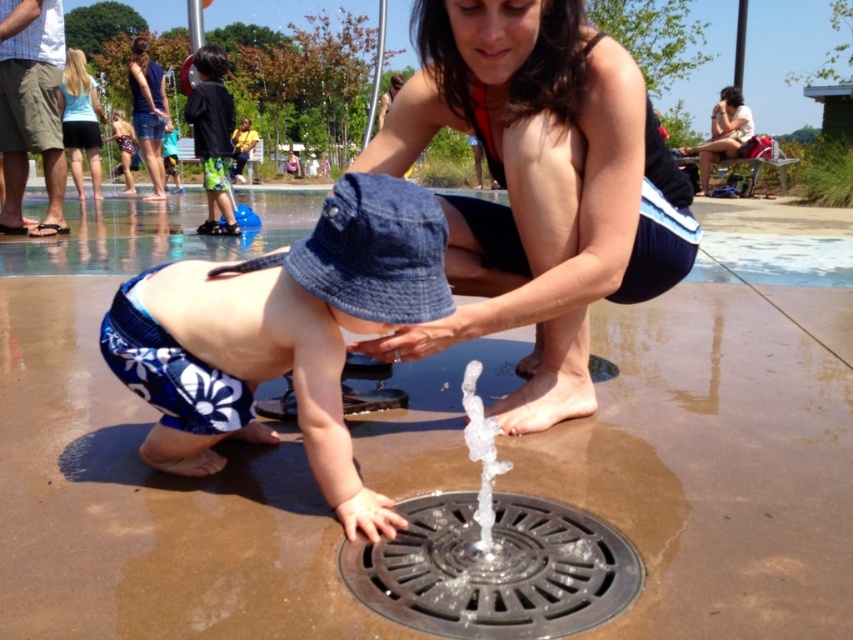
From the picture: Between black metal drain at center and green shorts at center, which one has more height?

green shorts at center is taller.

Who is higher up, black metal drain at center or green shorts at center?

green shorts at center is above.

This screenshot has width=853, height=640. What do you see at coordinates (494, 568) in the screenshot?
I see `black metal drain at center` at bounding box center [494, 568].

In order to click on black metal drain at center in this screenshot , I will do `click(494, 568)`.

Who is positioned more to the left, matte black swimsuit at center or green shorts at center?

green shorts at center

The height and width of the screenshot is (640, 853). What are the coordinates of `matte black swimsuit at center` in the screenshot? It's located at (538, 188).

Does point (579, 145) come farther from viewer compared to point (200, 140)?

No, (579, 145) is closer to viewer.

Locate an element on the screen. matte black swimsuit at center is located at coordinates (538, 188).

What are the coordinates of `blue floral swim trunks at lower left` in the screenshot? It's located at (280, 333).

Who is more distant from viewer, (172, 426) or (520, 557)?

The point (172, 426) is behind.

This screenshot has height=640, width=853. What do you see at coordinates (280, 333) in the screenshot?
I see `blue floral swim trunks at lower left` at bounding box center [280, 333].

Where is `blue floral swim trunks at lower left`? This screenshot has height=640, width=853. blue floral swim trunks at lower left is located at coordinates (280, 333).